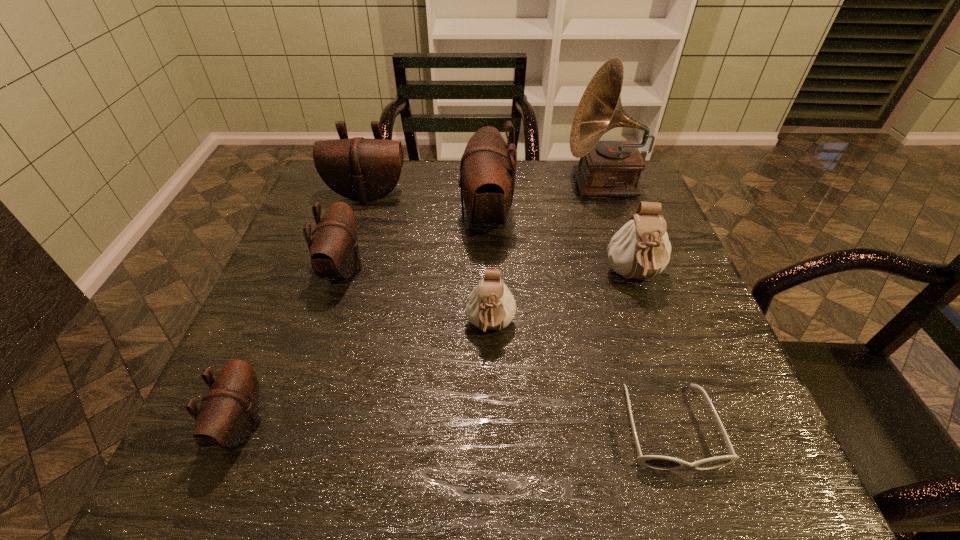
The image size is (960, 540). What are the coordinates of `phonograph record` in the screenshot? It's located at (606, 168).

This screenshot has width=960, height=540. What are the coordinates of `brown phonograph record` in the screenshot? It's located at (606, 168).

The width and height of the screenshot is (960, 540). I want to click on the tallest pouch, so click(487, 177).

Where is `the second tallest object`? The height and width of the screenshot is (540, 960). the second tallest object is located at coordinates (487, 177).

This screenshot has width=960, height=540. Find the location of `the second biggest brown pouch`. the second biggest brown pouch is located at coordinates (361, 169).

Identify the location of the rightmost pouch. (641, 248).

Find the location of a particular element. the farther white pouch is located at coordinates (641, 248).

Locate an element on the screen. The image size is (960, 540). the second smallest brown pouch is located at coordinates (334, 252).

Where is `the smaller white pouch`? the smaller white pouch is located at coordinates (490, 306).

I want to click on the third nearest object, so click(x=490, y=306).